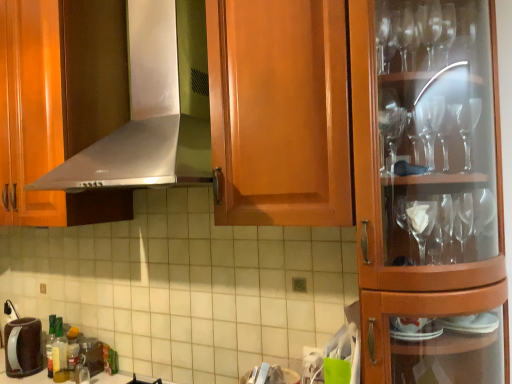
Question: Looking at their shapes, would you say metallic silver coffee maker at lower left, which is the 1th appliance in right-to-left order, is wider or thinner than translucent plastic bottle at lower left?

Choices:
 (A) thin
 (B) wide

Answer: (B)

Question: Is metallic silver coffee maker at lower left, which is the 1th appliance in right-to-left order, inside or outside of translucent plastic bottle at lower left?

Choices:
 (A) inside
 (B) outside

Answer: (B)

Question: Based on their relative distances, which object is nearer to the translucent plastic bottle at lower left?

Choices:
 (A) brushed metal faucet at lower left
 (B) satin silver exhaust hood at upper center
 (C) brown matte coffee pot at lower left, which is counted as the 1th appliance, starting from the left
 (D) metallic silver coffee maker at lower left, which is the second appliance in left-to-right order

Answer: (D)

Question: Based on their relative distances, which object is nearer to the satin silver exhaust hood at upper center?

Choices:
 (A) metallic silver coffee maker at lower left, which is the second appliance in left-to-right order
 (B) translucent plastic bottle at lower left
 (C) brown matte coffee pot at lower left, positioned as the second appliance in right-to-left order
 (D) brushed metal faucet at lower left

Answer: (A)